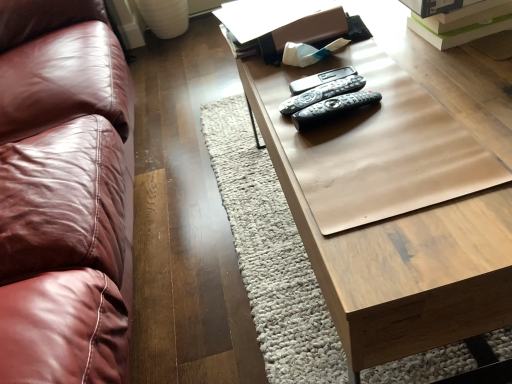
Image resolution: width=512 pixels, height=384 pixels. In order to click on vacant area on the back side of black plastic remotes at center, which appears as the 2th remote when viewed from the front in this screenshot , I will do [291, 74].